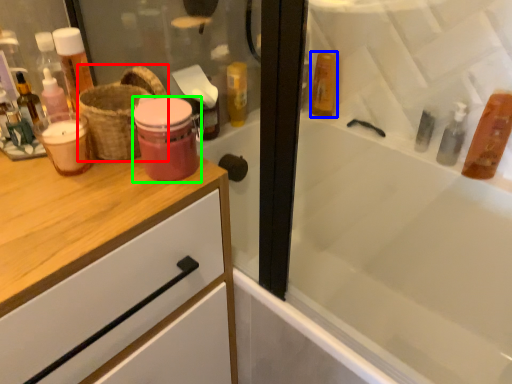
Question: Based on their relative distances, which object is nearer to basket (highlighted by a red box)? Choose from mouthwash (highlighted by a blue box) and mouthwash (highlighted by a green box).

Choices:
 (A) mouthwash
 (B) mouthwash

Answer: (B)